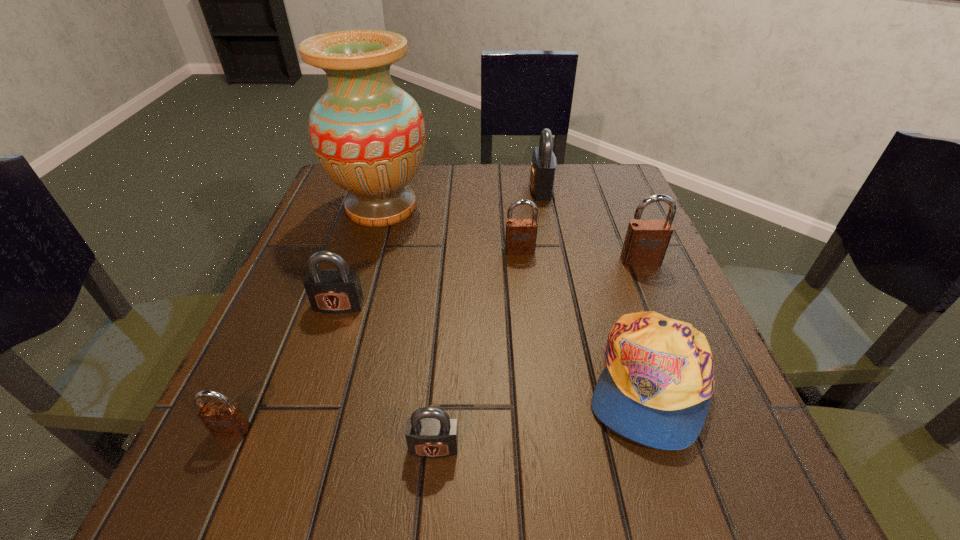
At what (x,y) coordinates should I click in order to perform the action: click on vacant position located on the front of the second nearest gray padlock near the keyhole. Please return your answer as a coordinate pair (x, y). Looking at the image, I should click on (311, 390).

Locate an element on the screen. This screenshot has height=540, width=960. vacant space located on the front-facing side of the smallest brown padlock is located at coordinates (212, 474).

Image resolution: width=960 pixels, height=540 pixels. Find the location of `vase at the far edge`. vase at the far edge is located at coordinates (368, 135).

The height and width of the screenshot is (540, 960). In order to click on padlock located in the far edge section of the desktop in this screenshot , I will do `click(543, 166)`.

Image resolution: width=960 pixels, height=540 pixels. In order to click on cap located in the near edge section of the desktop in this screenshot , I will do `click(656, 388)`.

Where is `padlock at the near edge`? padlock at the near edge is located at coordinates (430, 433).

Locate an element on the screen. vase that is at the left edge is located at coordinates (368, 135).

The image size is (960, 540). What are the coordinates of `padlock located in the right edge section of the desktop` in the screenshot? It's located at (646, 241).

Locate an element on the screen. This screenshot has height=540, width=960. cap positioned at the right edge is located at coordinates (656, 388).

Locate an element on the screen. Image resolution: width=960 pixels, height=540 pixels. object at the far left corner is located at coordinates (368, 135).